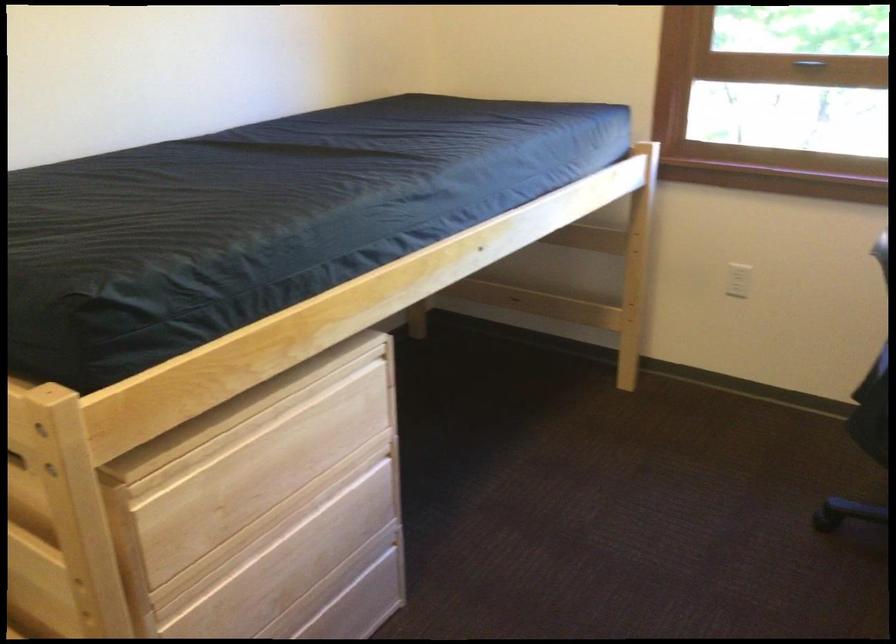
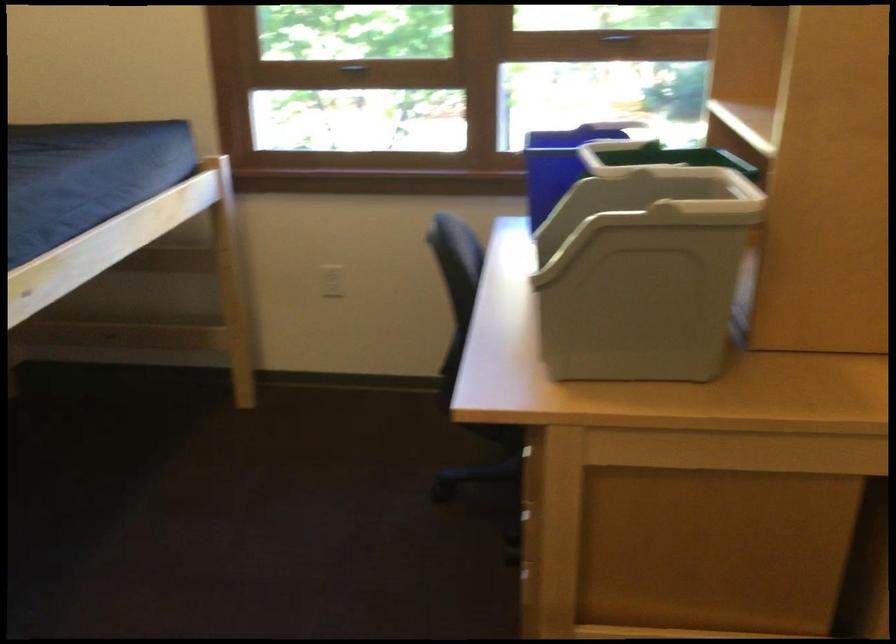
Question: How did the camera likely rotate?

Choices:
 (A) Left
 (B) Right
 (C) Up
 (D) Down

Answer: (B)